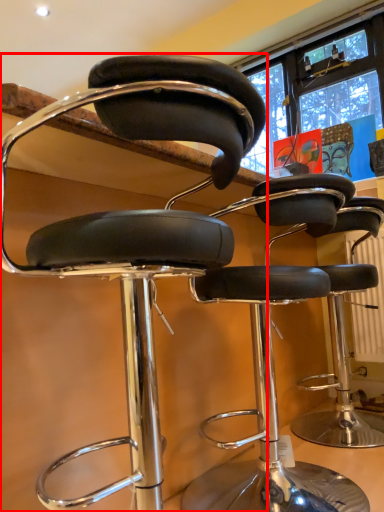
Question: From the image's perspective, where is chair (annotated by the red box) located in relation to chair in the image?

Choices:
 (A) below
 (B) above

Answer: (B)